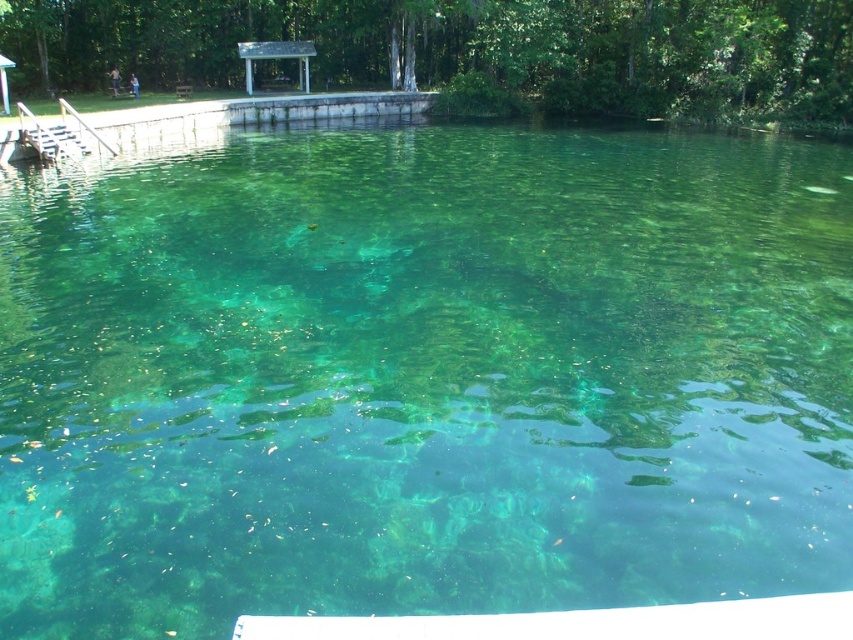
Can you confirm if wooden dock at left is shorter than white wooden gazebo at upper center?

Indeed, wooden dock at left has a lesser height compared to white wooden gazebo at upper center.

What do you see at coordinates (57, 132) in the screenshot? The image size is (853, 640). I see `wooden dock at left` at bounding box center [57, 132].

What do you see at coordinates (57, 132) in the screenshot? I see `wooden dock at left` at bounding box center [57, 132].

I want to click on wooden dock at left, so click(x=57, y=132).